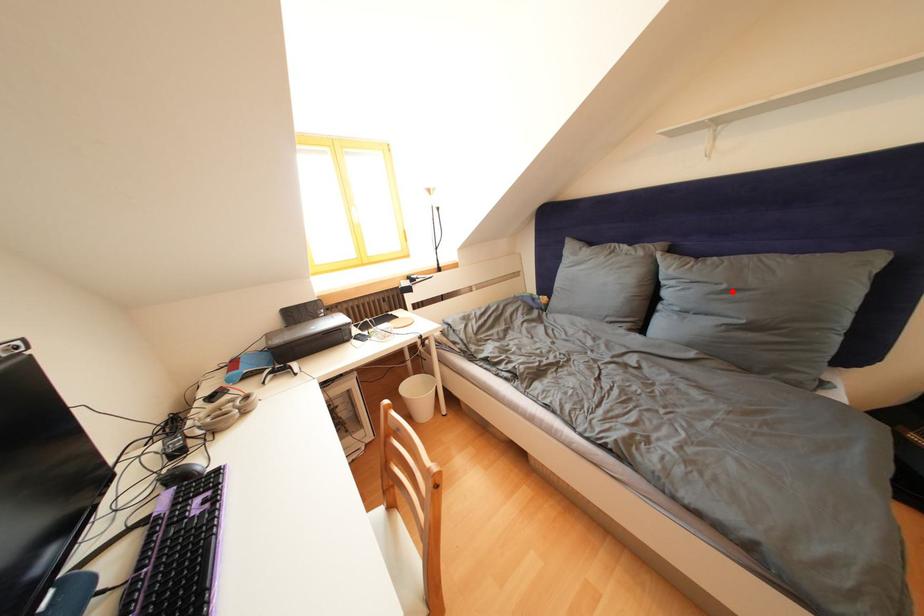
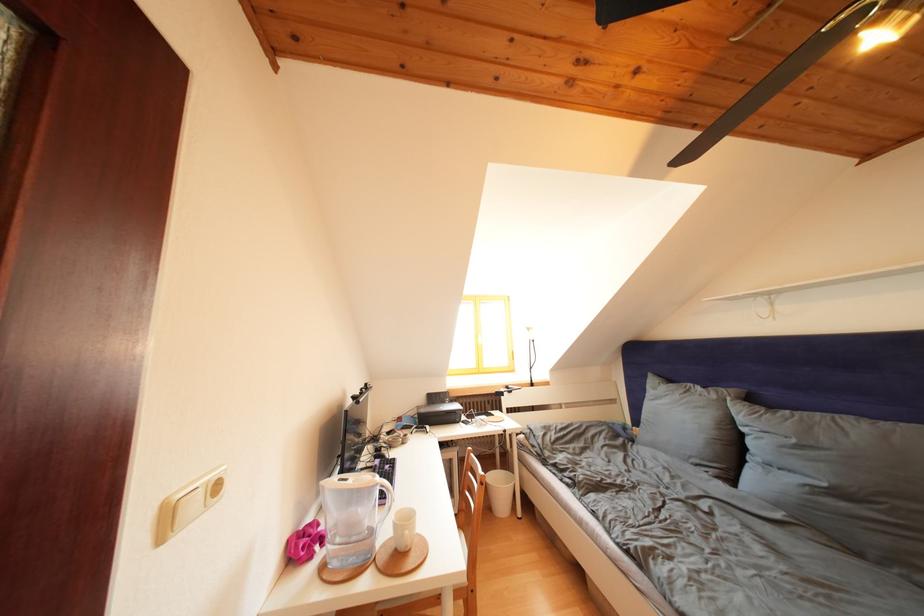
The point at the highlighted location is marked in the first image. Where is the corresponding point in the second image?

(801, 446)